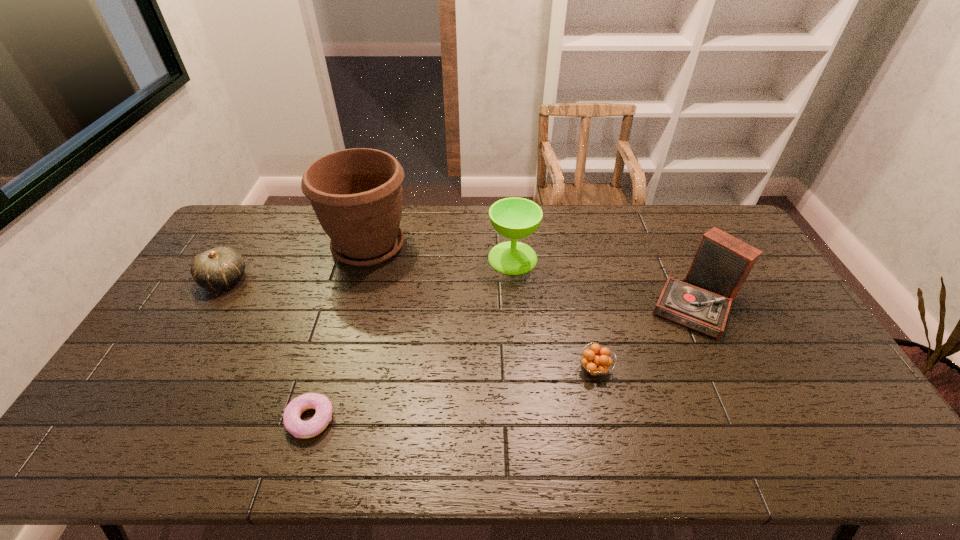
Locate an element on the screen. vacant space at the far edge is located at coordinates (617, 226).

Where is `vacant space at the near edge of the desktop`? Image resolution: width=960 pixels, height=540 pixels. vacant space at the near edge of the desktop is located at coordinates 424,436.

At what (x,y) coordinates should I click in order to perform the action: click on free region at the left edge of the desktop. Please return your answer as a coordinate pair (x, y). Looking at the image, I should click on (208, 327).

Where is `free point at the right edge`? The width and height of the screenshot is (960, 540). free point at the right edge is located at coordinates (804, 420).

Where is `unoccupied position between the phonograph record and the shortest object`? This screenshot has height=540, width=960. unoccupied position between the phonograph record and the shortest object is located at coordinates (505, 362).

Identify the location of free area in between the gourd and the tallest object. This screenshot has width=960, height=540. (297, 263).

The image size is (960, 540). What are the coordinates of `vacant space that's between the shortest object and the phonograph record` in the screenshot? It's located at (505, 362).

Identify the location of vacant space that is in between the shortest object and the fifth farthest object. Image resolution: width=960 pixels, height=540 pixels. (452, 394).

Where is `vacant area between the gourd and the nearest object`? The image size is (960, 540). vacant area between the gourd and the nearest object is located at coordinates (268, 349).

I want to click on free point between the nearest object and the second shortest object, so click(x=452, y=394).